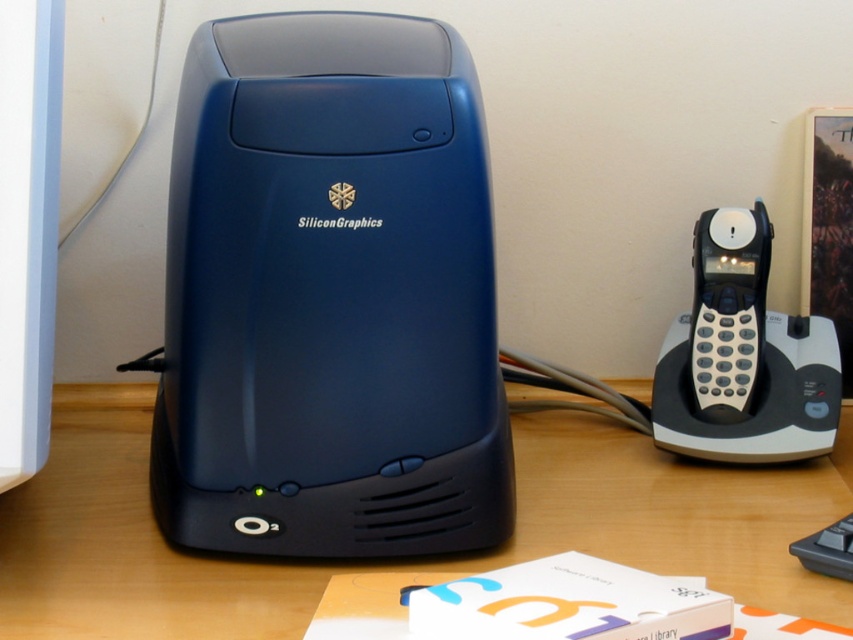
Is matte blue desktop computer at center above black plastic phone at right?

Indeed, matte blue desktop computer at center is positioned over black plastic phone at right.

Between point (305, 45) and point (756, 198), which one is positioned behind?

Point (756, 198)

Who is more forward, (248, 128) or (709, 317)?

Point (248, 128)

The image size is (853, 640). I want to click on matte blue desktop computer at center, so click(329, 296).

Is matte black table at center taller than black plastic phone at right?

Incorrect, matte black table at center's height is not larger of black plastic phone at right's.

Image resolution: width=853 pixels, height=640 pixels. In order to click on matte black table at center in this screenshot , I will do `click(395, 561)`.

You are a GUI agent. You are given a task and a screenshot of the screen. Output one action in this format:
    pyautogui.click(x=<x>, y=<y>)
    Task: Click on the matte black table at center
    Image resolution: width=853 pixels, height=640 pixels.
    Given the screenshot: What is the action you would take?
    pyautogui.click(x=395, y=561)

Can you confirm if matte blue desktop computer at center is positioned to the left of matte black table at center?

Yes, matte blue desktop computer at center is to the left of matte black table at center.

Which is below, matte blue desktop computer at center or matte black table at center?

matte black table at center

Is point (424, 506) positioned behind point (144, 524)?

No, it is not.

Where is `matte blue desktop computer at center`? The width and height of the screenshot is (853, 640). matte blue desktop computer at center is located at coordinates (329, 296).